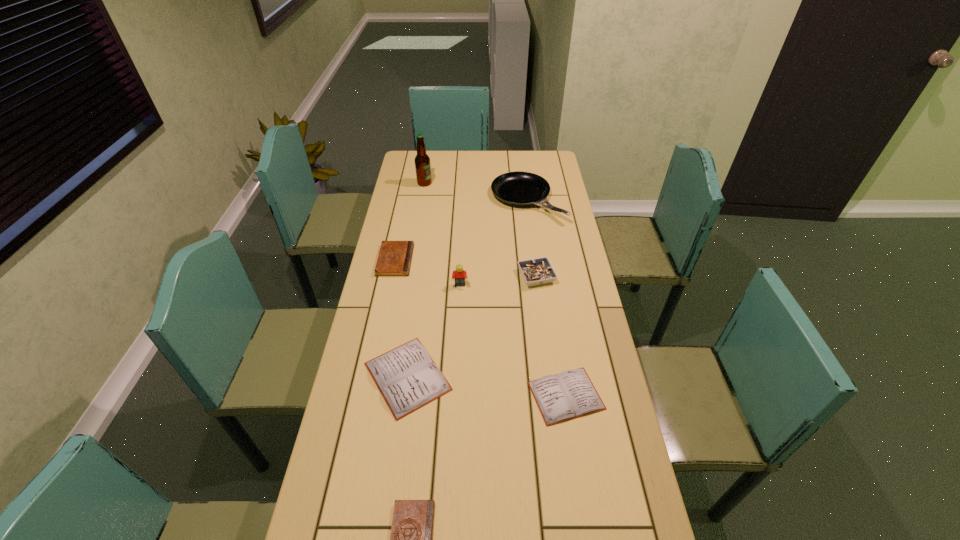
At what (x,y) coordinates should I click in order to perform the action: click on vacant space that is in between the smaller white diary and the fifth shortest object. Please return your answer as a coordinate pair (x, y). Looking at the image, I should click on pos(551,336).

The width and height of the screenshot is (960, 540). What are the coordinates of `blank region between the Lego and the left white diary` in the screenshot? It's located at (434, 331).

At what (x,y) coordinates should I click in order to perform the action: click on vacant area that lies between the ashtray and the right white diary. Please return your answer as a coordinate pair (x, y). Looking at the image, I should click on (551, 336).

Find the location of `object that can be found as the sixth closest to the farthest diary`. object that can be found as the sixth closest to the farthest diary is located at coordinates (570, 394).

Locate an element on the screen. The height and width of the screenshot is (540, 960). object identified as the sixth closest to the bigger brown diary is located at coordinates (570, 394).

Select which diary appears as the fourth closest to the pan. Please provide its 2D coordinates. Your answer should be formatted as a tuple, i.e. [(x, y)], where the tuple contains the x and y coordinates of a point satisfying the conditions above.

[(412, 525)]

Select which diary is the third closest to the gray ashtray. Please provide its 2D coordinates. Your answer should be formatted as a tuple, i.e. [(x, y)], where the tuple contains the x and y coordinates of a point satisfying the conditions above.

[(394, 259)]

At what (x,y) coordinates should I click in order to perform the action: click on white diary that is the nearest to the second tallest object. Please return your answer as a coordinate pair (x, y). This screenshot has width=960, height=540. Looking at the image, I should click on (408, 379).

Where is `white diary that is the second closest one to the ashtray`? The width and height of the screenshot is (960, 540). white diary that is the second closest one to the ashtray is located at coordinates (570, 394).

Locate an element on the screen. free spot that satisfies the following two spatial constraints: 1. on the spine side of the farther brown diary; 2. on the left side of the smaller white diary is located at coordinates (367, 396).